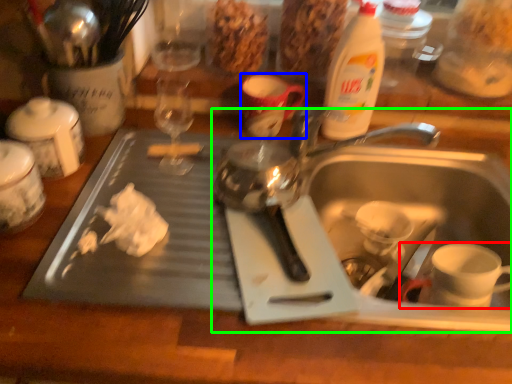
Question: Estimate the real-world distances between objects in this image. Which object is closer to coffee cup (highlighted by a red box), mug (highlighted by a blue box) or sink (highlighted by a green box)?

Choices:
 (A) mug
 (B) sink

Answer: (B)